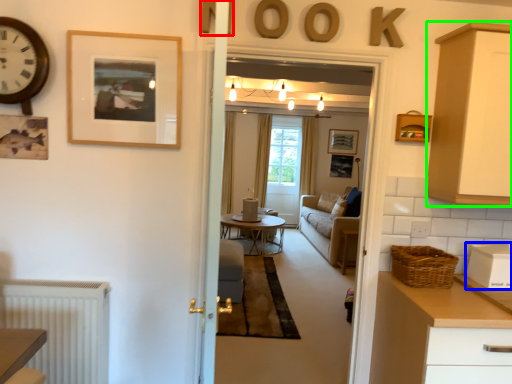
Question: Estimate the real-world distances between objects in this image. Which object is closer to letter (highlighted by a red box), appliance (highlighted by a blue box) or cabinetry (highlighted by a green box)?

Choices:
 (A) appliance
 (B) cabinetry

Answer: (B)